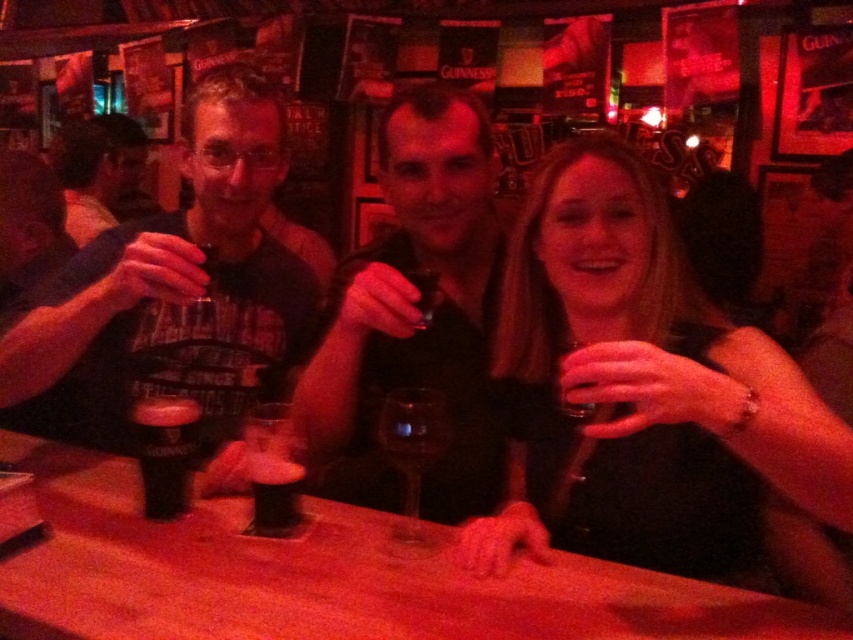
You are a bartender at the Irish pub. You need to clean the dark brown glass at center and the guinness stout glass at center. Which one should you clean first if you want to avoid reaching over any glasses?

The dark brown glass at center is behind the guinness stout glass at center, so you should clean the guinness stout glass at center first to avoid reaching over it.

You are at a bar and want to grab the transparent glass wine glass at center. Where should you look? Please provide coordinates in the format of x,y.

The transparent glass wine glass at center is located at coordinates (412, 458).